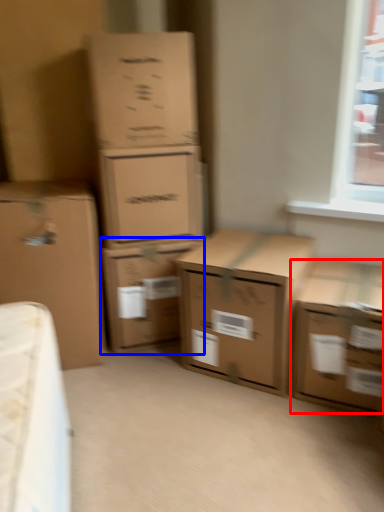
Question: Among these objects, which one is farthest to the camera, box (highlighted by a red box) or box (highlighted by a blue box)?

Choices:
 (A) box
 (B) box

Answer: (B)